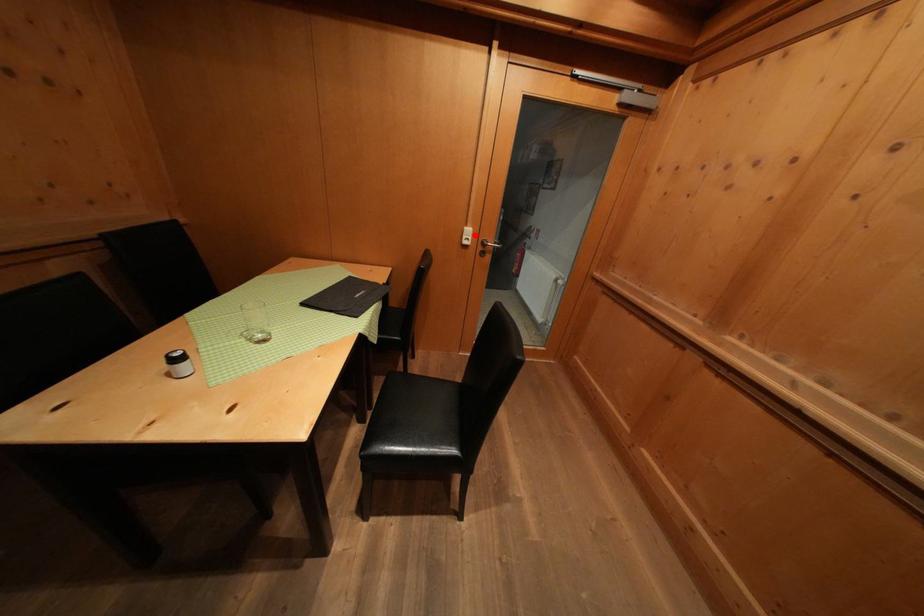
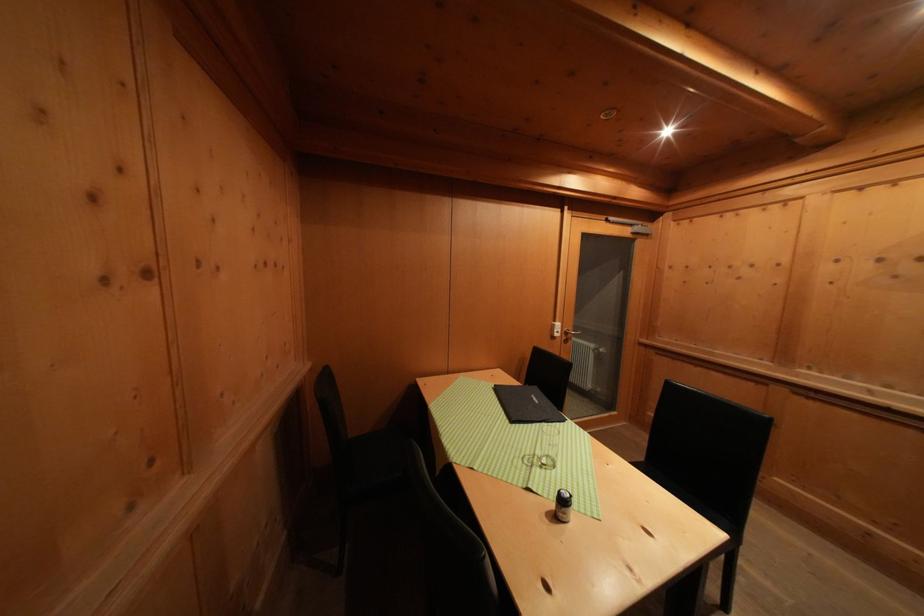
Question: A red point is marked in image1. In image2, is the corresponding 3D point closer to the camera or farther? Reply with the corresponding letter.

Choices:
 (A) The corresponding 3D point is closer.
 (B) The corresponding 3D point is farther.

Answer: (B)